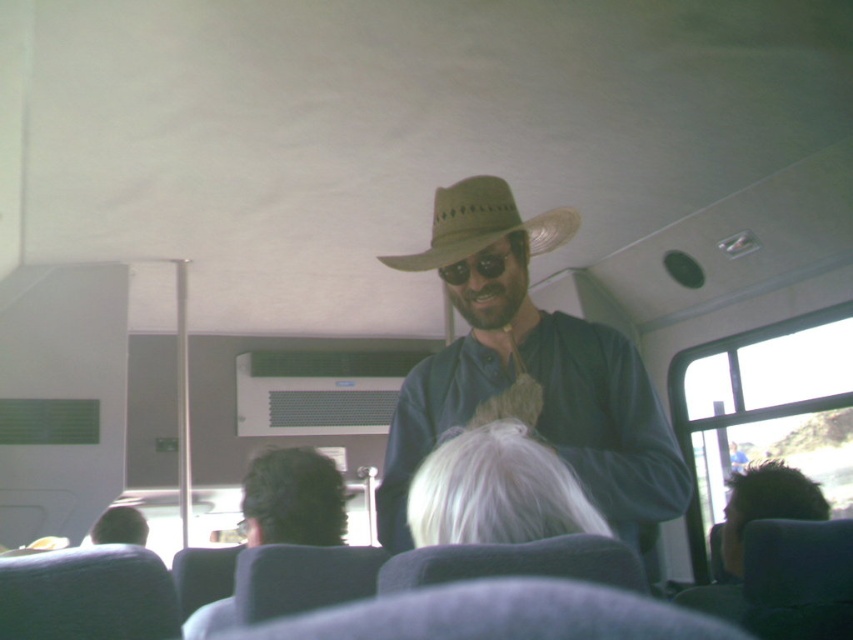
Is point (643, 381) positioned behind point (218, 630)?

That is True.

Is matte straw hat at center to the left of dark brown hair at center from the viewer's perspective?

Incorrect, matte straw hat at center is not on the left side of dark brown hair at center.

The height and width of the screenshot is (640, 853). I want to click on matte straw hat at center, so click(x=531, y=376).

How distant is tan straw hat at center from black matte sunglasses at center?

The distance of tan straw hat at center from black matte sunglasses at center is 2.95 inches.

Is tan straw hat at center bigger than black matte sunglasses at center?

Yes.

Find the location of `tan straw hat at center`. tan straw hat at center is located at coordinates point(482,225).

Based on the photo, is matte straw hat at center further to the viewer compared to black matte sunglasses at center?

No, matte straw hat at center is in front of black matte sunglasses at center.

Who is more forward, (518, 310) or (457, 276)?

Point (457, 276) is more forward.

In order to click on matte straw hat at center in this screenshot , I will do `click(531, 376)`.